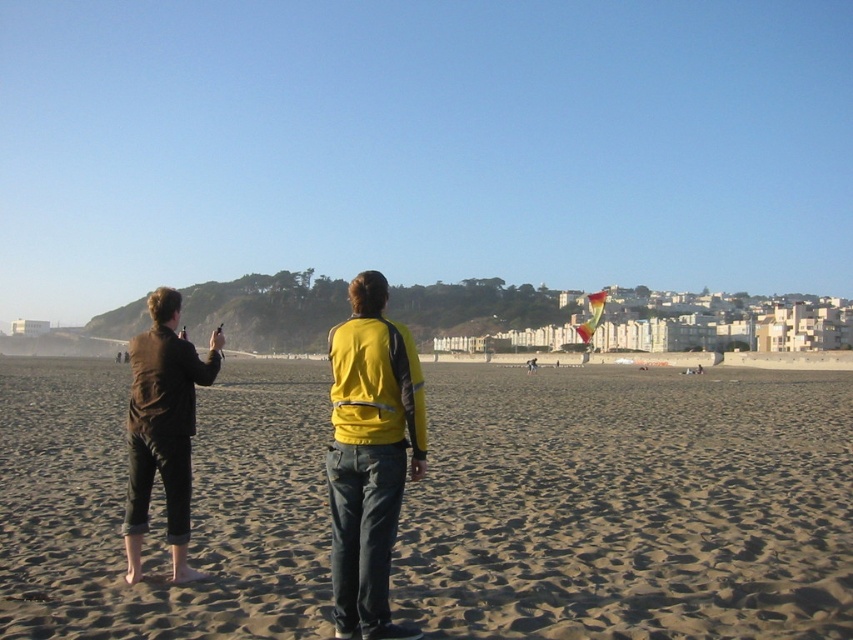
Question: Is matte black jacket at center bigger than dark brown leather jacket at left?

Choices:
 (A) no
 (B) yes

Answer: (B)

Question: Which point is farther from the camera taking this photo?

Choices:
 (A) (364, 564)
 (B) (583, 321)

Answer: (B)

Question: Does matte black jacket at center have a greater width compared to multicolored fabric kite at center?

Choices:
 (A) yes
 (B) no

Answer: (B)

Question: Does matte black jacket at center come behind dark brown leather jacket at left?

Choices:
 (A) yes
 (B) no

Answer: (B)

Question: Which of these objects is positioned closest to the dark brown leather jacket at left?

Choices:
 (A) brown sand at lower center
 (B) yellow fabric jacket at center

Answer: (B)

Question: Which object appears farthest from the camera in this image?

Choices:
 (A) multicolored fabric kite at center
 (B) brown sand at lower center
 (C) yellow fabric jacket at center
 (D) dark brown leather jacket at left

Answer: (A)